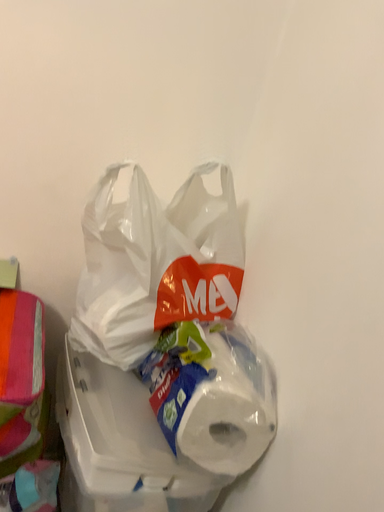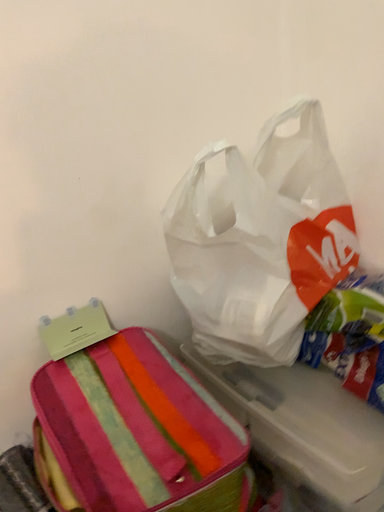
Question: How did the camera likely rotate when shooting the video?

Choices:
 (A) rotated upward
 (B) rotated downward

Answer: (B)